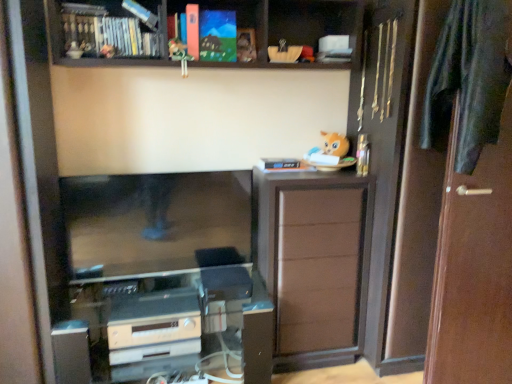
Question: From a real-world perspective, is dark green fabric at right over satin silver appliance at lower center?

Choices:
 (A) no
 (B) yes

Answer: (B)

Question: Can you confirm if dark green fabric at right is shorter than satin silver appliance at lower center?

Choices:
 (A) no
 (B) yes

Answer: (A)

Question: Is dark green fabric at right behind satin silver appliance at lower center?

Choices:
 (A) yes
 (B) no

Answer: (B)

Question: Can you confirm if dark green fabric at right is positioned to the left of satin silver appliance at lower center?

Choices:
 (A) no
 (B) yes

Answer: (A)

Question: Is dark green fabric at right thinner than satin silver appliance at lower center?

Choices:
 (A) yes
 (B) no

Answer: (A)

Question: Is metallic figure at upper center, which is counted as the first toy, starting from the left, spatially inside matte acrylic painting at upper center, the 2th book when ordered from left to right, or outside of it?

Choices:
 (A) outside
 (B) inside

Answer: (A)

Question: In terms of size, does metallic figure at upper center, the 2th toy in the bottom-to-top sequence, appear bigger or smaller than matte acrylic painting at upper center, which ranks as the 1th book in right-to-left order?

Choices:
 (A) small
 (B) big

Answer: (A)

Question: Is metallic figure at upper center, marked as the 1th toy in a top-to-bottom arrangement, taller or shorter than matte acrylic painting at upper center, which ranks as the 1th book in right-to-left order?

Choices:
 (A) short
 (B) tall

Answer: (A)

Question: Is metallic figure at upper center, the 2th toy in the right-to-left sequence, to the left or to the right of matte acrylic painting at upper center, the 2th book when ordered from left to right, in the image?

Choices:
 (A) left
 (B) right

Answer: (A)

Question: Based on their sizes in the image, would you say satin silver appliance at lower center is bigger or smaller than brown wood door at right?

Choices:
 (A) big
 (B) small

Answer: (B)

Question: From a real-world perspective, is satin silver appliance at lower center above or below brown wood door at right?

Choices:
 (A) above
 (B) below

Answer: (B)

Question: Considering the positions of point (138, 334) and point (503, 173), is point (138, 334) closer or farther from the camera than point (503, 173)?

Choices:
 (A) closer
 (B) farther

Answer: (B)

Question: From their relative heights in the image, would you say satin silver appliance at lower center is taller or shorter than brown wood door at right?

Choices:
 (A) tall
 (B) short

Answer: (B)

Question: Considering the positions of satin silver appliance at lower center and matte acrylic painting at upper center, the 2th book when ordered from left to right, in the image, is satin silver appliance at lower center bigger or smaller than matte acrylic painting at upper center, the 2th book when ordered from left to right,?

Choices:
 (A) small
 (B) big

Answer: (B)

Question: Is satin silver appliance at lower center inside the boundaries of matte acrylic painting at upper center, which ranks as the 1th book in right-to-left order, or outside?

Choices:
 (A) outside
 (B) inside

Answer: (A)